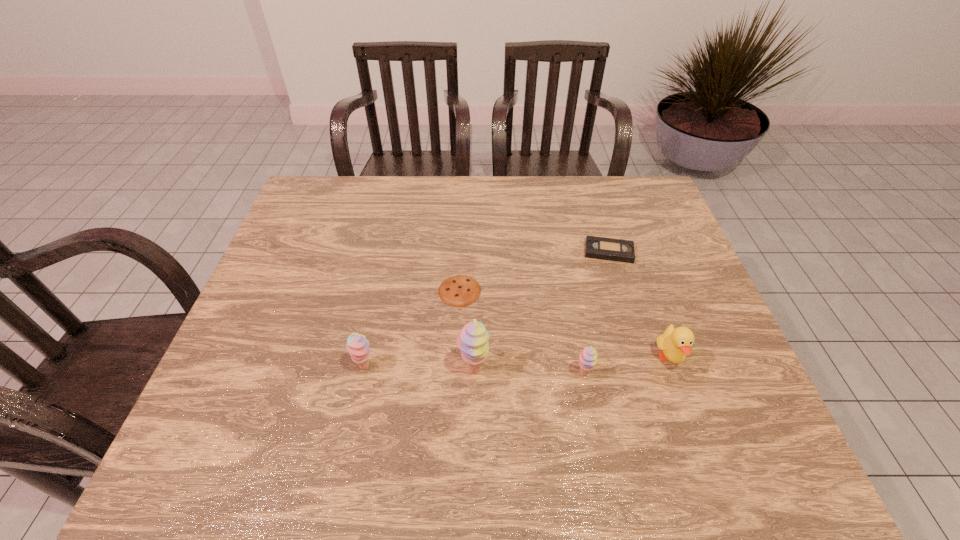
At what (x,y) coordinates should I click in order to perform the action: click on vacant area that lies between the fifth nearest object and the rightmost sherbert. Please return your answer as a coordinate pair (x, y). Looking at the image, I should click on (521, 332).

At what (x,y) coordinates should I click in order to perform the action: click on free space between the tallest object and the fifth tallest object. Please return your answer as a coordinate pair (x, y). The width and height of the screenshot is (960, 540). Looking at the image, I should click on (541, 311).

The width and height of the screenshot is (960, 540). I want to click on free point between the cookie and the duckling, so click(x=564, y=325).

The height and width of the screenshot is (540, 960). Find the location of `free point between the leftmost object and the shortest object`. free point between the leftmost object and the shortest object is located at coordinates (412, 329).

Identify which object is the second closest to the duckling. Please provide its 2D coordinates. Your answer should be formatted as a tuple, i.e. [(x, y)], where the tuple contains the x and y coordinates of a point satisfying the conditions above.

[(602, 248)]

Where is `object that ranks as the fourth closest to the shortest sherbert`? The height and width of the screenshot is (540, 960). object that ranks as the fourth closest to the shortest sherbert is located at coordinates (602, 248).

In order to click on the second closest sherbert to the tallest object in this screenshot , I will do `click(588, 357)`.

Find the location of a particular element. This screenshot has height=540, width=960. the second closest sherbert to the leftmost object is located at coordinates (588, 357).

I want to click on free spot that satisfies the following two spatial constraints: 1. on the back side of the videotape; 2. on the left side of the third object from right to left, so click(561, 252).